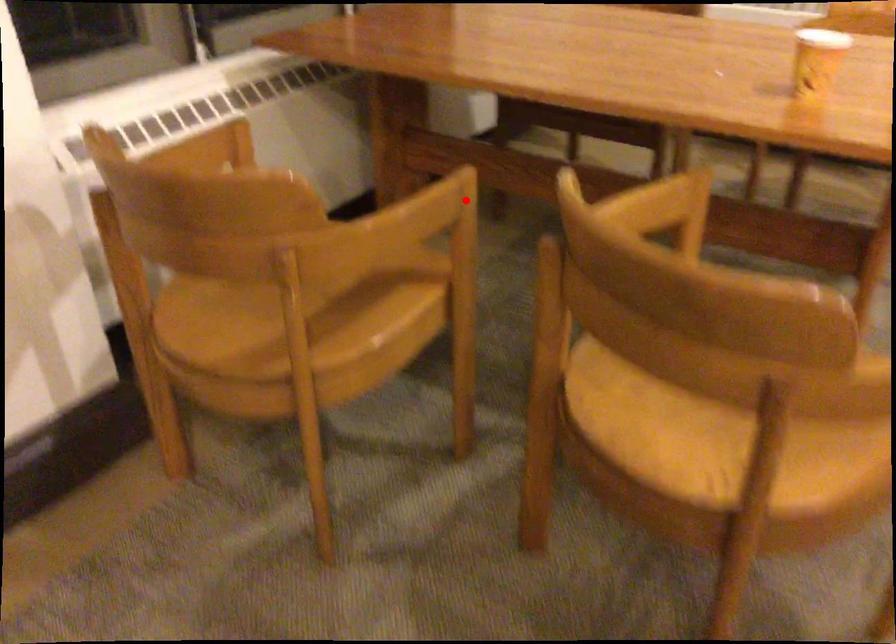
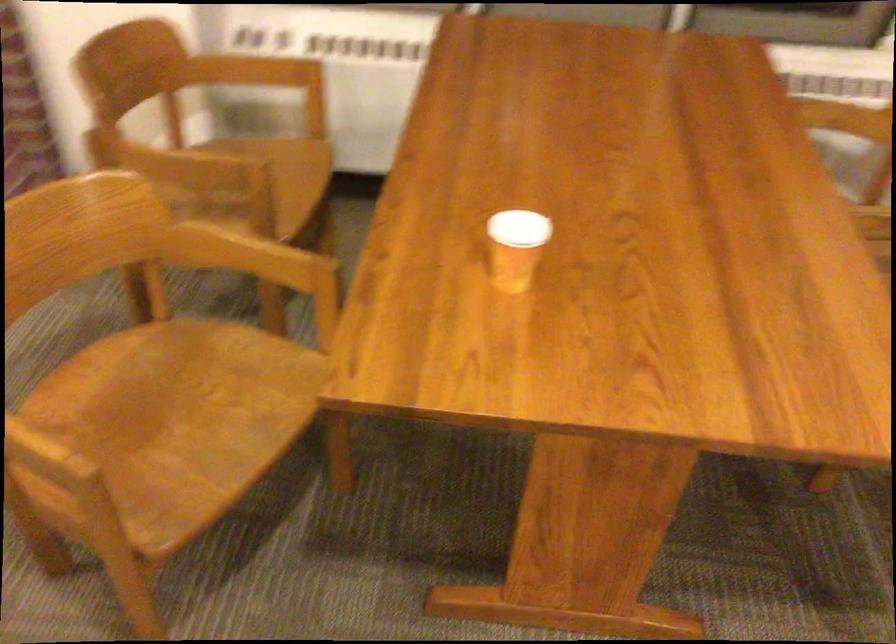
Where in the second image is the point corresponding to the highlighted location from the first image?

(252, 182)